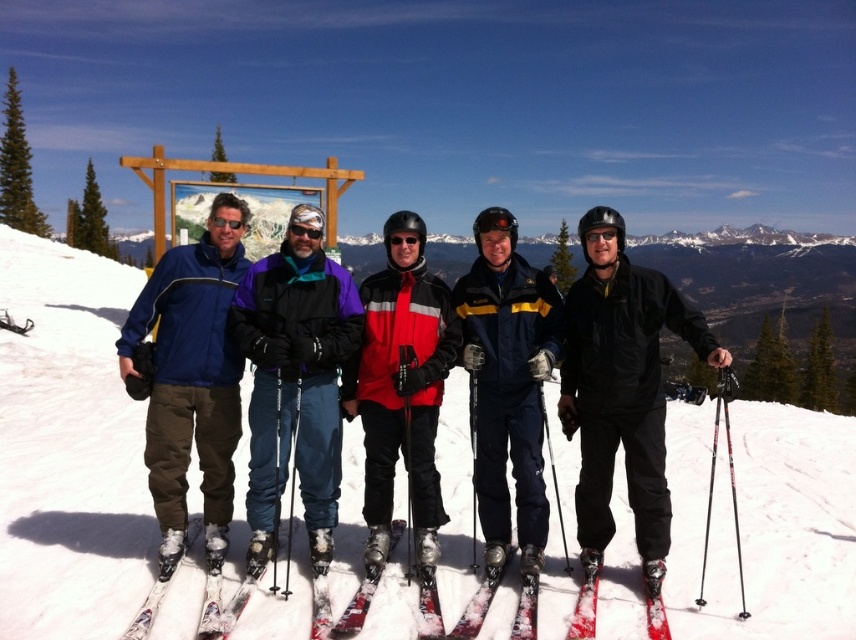
Question: Which point is farther to the camera?

Choices:
 (A) red matte jacket at center
 (B) shiny red ski at lower right
 (C) metallic skis at center

Answer: (A)

Question: Which object appears farthest from the camera in this image?

Choices:
 (A) black matte jacket at center
 (B) shiny metallic skis at center

Answer: (A)

Question: Observing the image, what is the correct spatial positioning of black matte jacket at center in reference to matte blue jacket at center?

Choices:
 (A) left
 (B) right

Answer: (B)

Question: Is black matte jacket at center in front of purple fleece jacket at center?

Choices:
 (A) no
 (B) yes

Answer: (B)

Question: Based on their relative distances, which object is farther from the purple fleece jacket at center?

Choices:
 (A) matte blue jacket at center
 (B) white matte ski at lower left
 (C) metallic skis at center

Answer: (C)

Question: Does metallic skis at center have a larger size compared to matte black goggles at center?

Choices:
 (A) yes
 (B) no

Answer: (A)